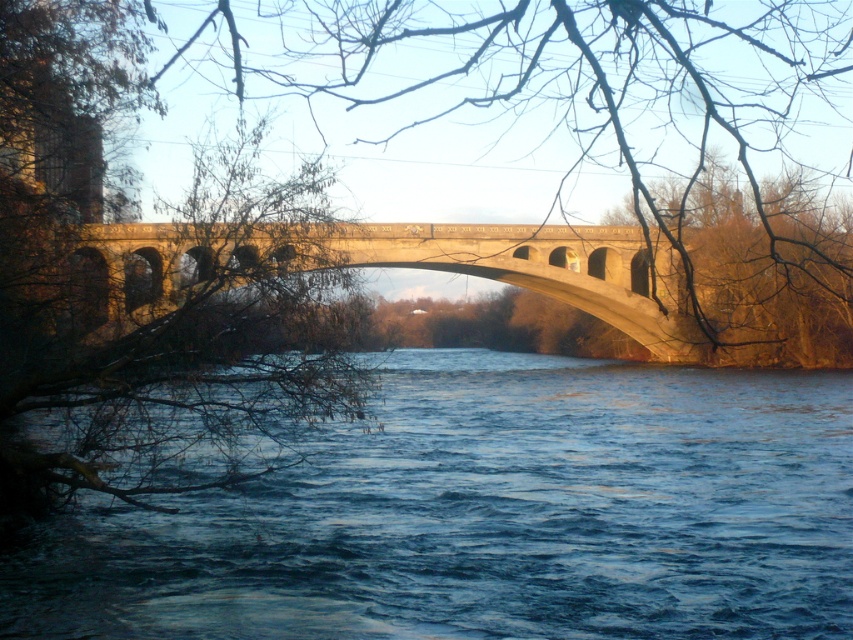
Question: Which object appears closest to the camera in this image?

Choices:
 (A) brown textured tree at center
 (B) blue water at center

Answer: (A)

Question: Which of these objects is positioned farthest from the brown textured tree at center?

Choices:
 (A) concrete bridge at center
 (B) blue water at center
 (C) brown leafless branches at left

Answer: (C)

Question: Where is blue water at center located in relation to brown textured tree at center in the image?

Choices:
 (A) left
 (B) right

Answer: (A)

Question: Considering the relative positions of concrete bridge at center and brown textured tree at center in the image provided, where is concrete bridge at center located with respect to brown textured tree at center?

Choices:
 (A) left
 (B) right

Answer: (A)

Question: Based on their relative distances, which object is nearer to the brown leafless branches at left?

Choices:
 (A) blue water at center
 (B) concrete bridge at center
 (C) brown textured tree at center

Answer: (B)

Question: Can you confirm if blue water at center is positioned above concrete bridge at center?

Choices:
 (A) no
 (B) yes

Answer: (A)